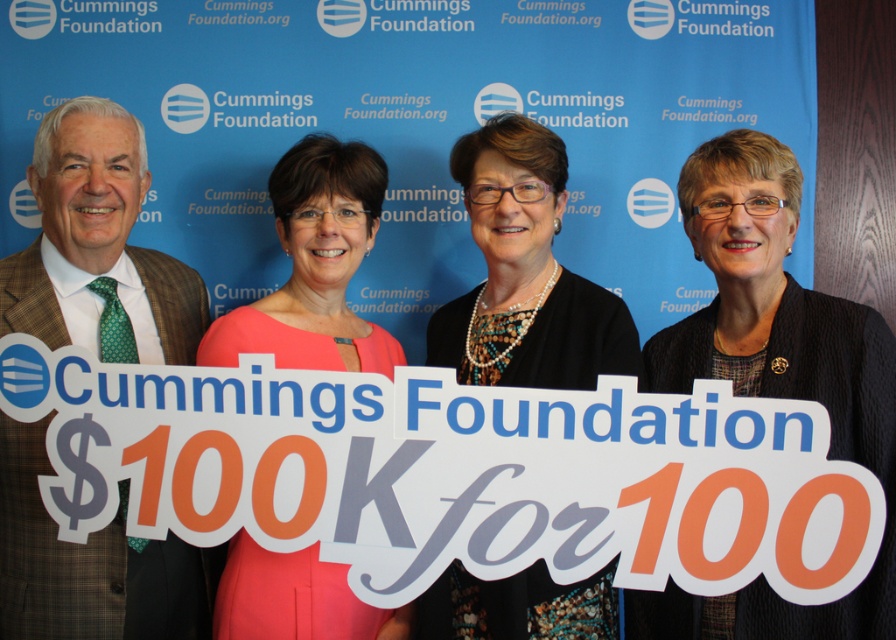
Based on the photo, you are taking a photo of the scene described. You want to focus on the point at point (82, 628) and point (570, 321). Which point should you focus on first to ensure both are in focus?

You should focus on point (82, 628) first because it is closer to the camera than point (570, 321), so focusing on the closer point will ensure both are in focus.

Based on the photo, you are a photographer at the Cummings Foundation event. You need to adjust the lighting to ensure both the green textured tie at left and the black textured blazer at center are well lit. Considering their heights, which object should be placed closer to the light source?

The green textured tie at left should be placed closer to the light source because it has a greater height than the black textured blazer at center, ensuring both receive adequate lighting.